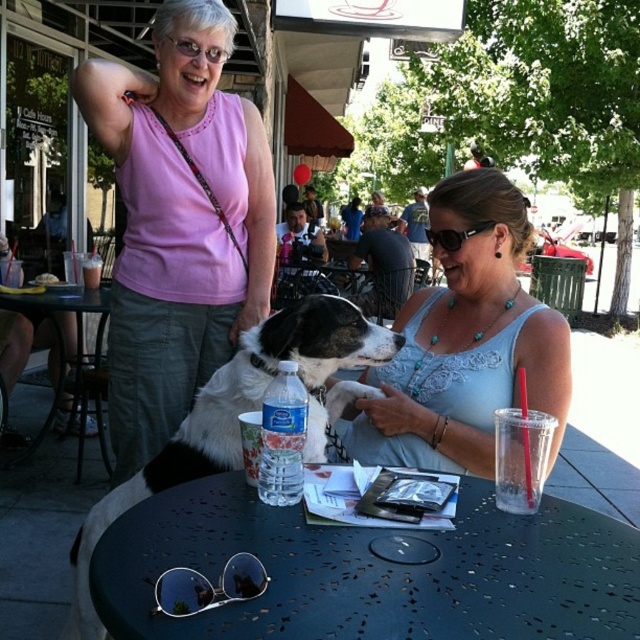
Question: In this image, where is pearl necklace at center located relative to metallic black table at lower left?

Choices:
 (A) below
 (B) above

Answer: (B)

Question: Which of the following is the closest to the observer?

Choices:
 (A) (484, 221)
 (B) (243, 232)

Answer: (A)

Question: Does black and white fur dog at center have a smaller size compared to clear plastic water bottle at center?

Choices:
 (A) yes
 (B) no

Answer: (B)

Question: Which point is farther to the camera?

Choices:
 (A) click(x=298, y=456)
 (B) click(x=236, y=378)
 (C) click(x=156, y=600)
 (D) click(x=124, y=340)

Answer: (D)

Question: Does metallic black table at center appear on the right side of pearl necklace at center?

Choices:
 (A) no
 (B) yes

Answer: (A)

Question: Which point is farther from the camera taking this photo?

Choices:
 (A) click(x=52, y=397)
 (B) click(x=300, y=412)
 (C) click(x=241, y=561)

Answer: (A)